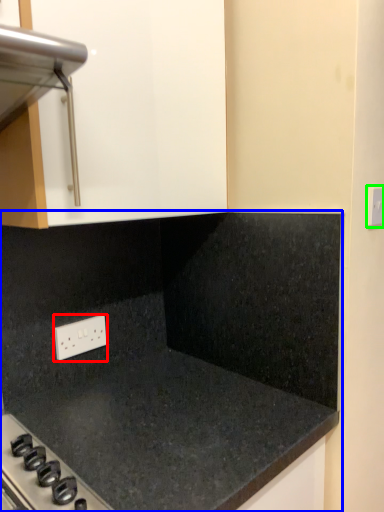
Question: Estimate the real-world distances between objects in this image. Which object is farther from electric outlet (highlighted by a red box), countertop (highlighted by a blue box) or electric outlet (highlighted by a green box)?

Choices:
 (A) countertop
 (B) electric outlet

Answer: (B)